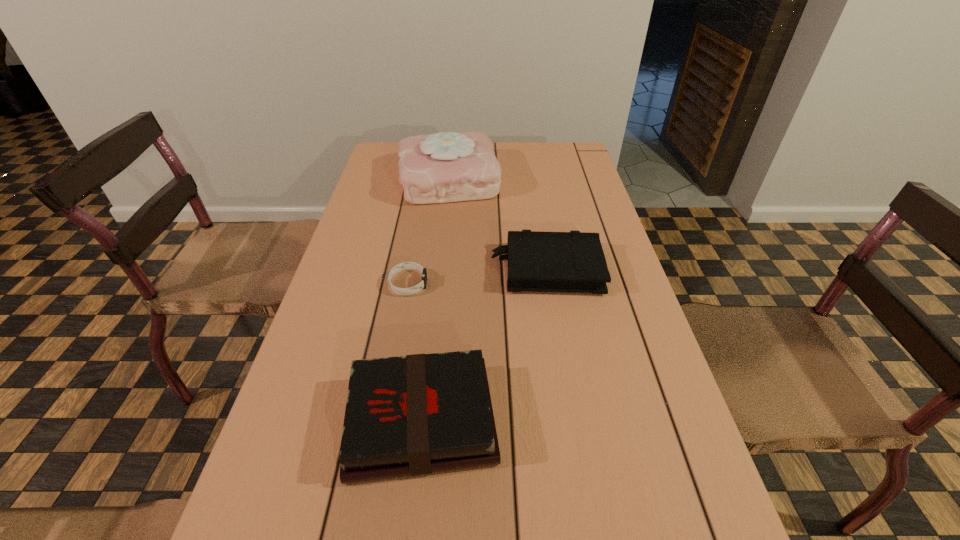
At what (x,y) coordinates should I click in order to perform the action: click on cake. Please return your answer as a coordinate pair (x, y). Looking at the image, I should click on (443, 167).

Where is `the tallest object`? This screenshot has width=960, height=540. the tallest object is located at coordinates (443, 167).

You are a GUI agent. You are given a task and a screenshot of the screen. Output one action in this format:
    pyautogui.click(x=<x>, y=<y>)
    Task: Click on the nearest object
    This screenshot has width=960, height=540.
    Given the screenshot: What is the action you would take?
    pyautogui.click(x=417, y=414)

This screenshot has height=540, width=960. I want to click on Bible, so click(x=574, y=261).

The image size is (960, 540). In order to click on the shortest object in this screenshot , I will do `click(406, 265)`.

Image resolution: width=960 pixels, height=540 pixels. Find the location of `free spot located on the front of the farthest object`. free spot located on the front of the farthest object is located at coordinates (437, 299).

At what (x,y) coordinates should I click in order to perform the action: click on vacant space situated 0.200m on the back of the hardback book. Please return your answer as a coordinate pair (x, y). The width and height of the screenshot is (960, 540). Looking at the image, I should click on (434, 299).

This screenshot has width=960, height=540. What are the coordinates of `blank area located on the back of the Bible` in the screenshot? It's located at (531, 177).

This screenshot has width=960, height=540. I want to click on blank area located 0.280m on the outer surface of the shortest object, so click(x=540, y=284).

This screenshot has height=540, width=960. Identify the location of object at the far edge. (443, 167).